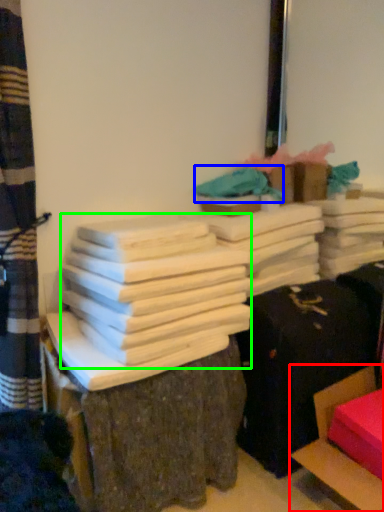
Question: Based on their relative distances, which object is farther from furniture (highlighted by a red box)? Choose from fabric (highlighted by a blue box) and bundle (highlighted by a green box).

Choices:
 (A) fabric
 (B) bundle

Answer: (A)